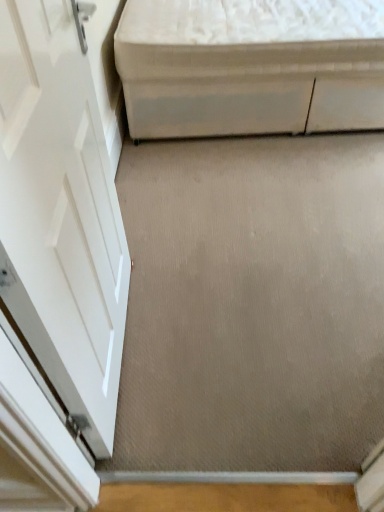
The image size is (384, 512). Find the location of `free space above beige carpet at center (from a real-world perspective)`. free space above beige carpet at center (from a real-world perspective) is located at coordinates (257, 249).